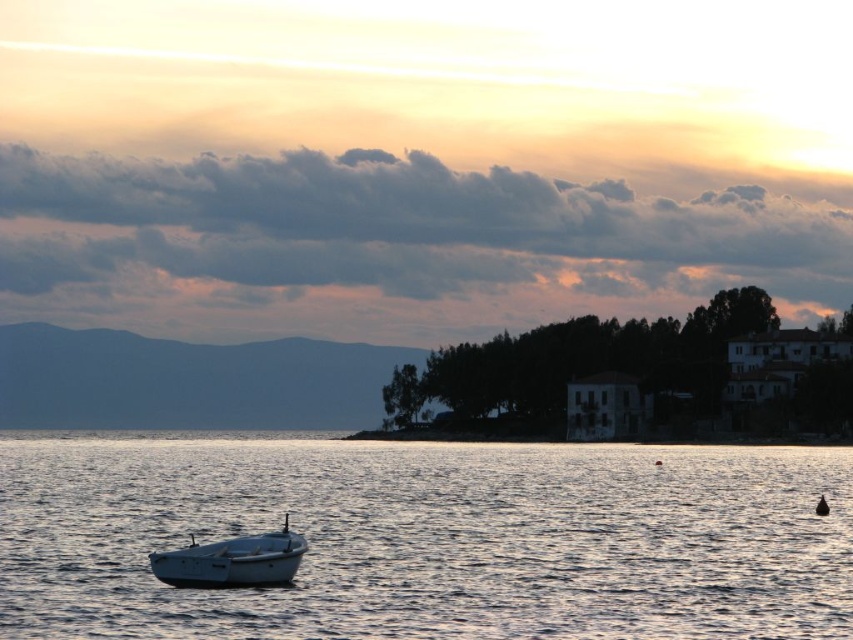
Which is more to the right, silvery water at boat left or white matte boat at lower left?

From the viewer's perspective, silvery water at boat left appears more on the right side.

Looking at this image, does silvery water at boat left appear under white matte boat at lower left?

Yes.

Where is `silvery water at boat left`? silvery water at boat left is located at coordinates click(428, 538).

Where is `silvery water at boat left`? The image size is (853, 640). silvery water at boat left is located at coordinates (428, 538).